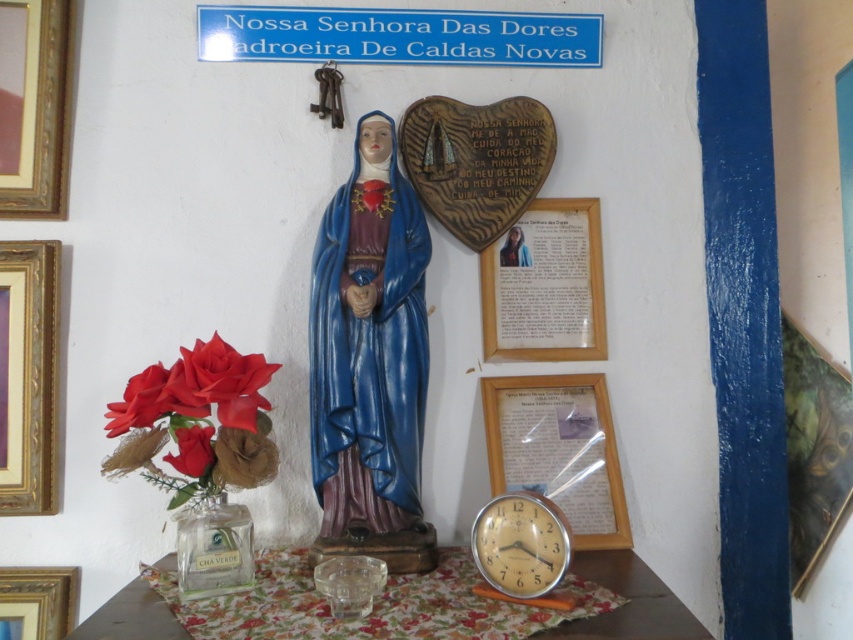
Is matte glass picture frame at lower right taller than wooden framed paper at center?

In fact, matte glass picture frame at lower right may be shorter than wooden framed paper at center.

Between matte glass picture frame at lower right and wooden framed paper at center, which one is positioned higher?

Positioned higher is wooden framed paper at center.

This screenshot has height=640, width=853. Identify the location of matte glass picture frame at lower right. (558, 451).

Find the location of a particular element. Image resolution: width=853 pixels, height=640 pixels. matte glass picture frame at lower right is located at coordinates (558, 451).

Between point (171, 484) and point (178, 442), which one is positioned behind?

Point (171, 484)

Does point (105, 460) lie behind point (206, 432)?

Yes, point (105, 460) is behind point (206, 432).

The height and width of the screenshot is (640, 853). Identify the location of matte plastic roses at left. (196, 422).

Between point (790, 435) and point (6, 580), which one is positioned behind?

The point (790, 435) is more distant.

Which of these two, metallic gold picture frame at right or wooden picture frame at lower left, stands taller?

metallic gold picture frame at right

Is point (799, 504) positioned behind point (70, 580)?

Yes, point (799, 504) is farther from viewer.

Identify the location of metallic gold picture frame at right. This screenshot has height=640, width=853. (814, 449).